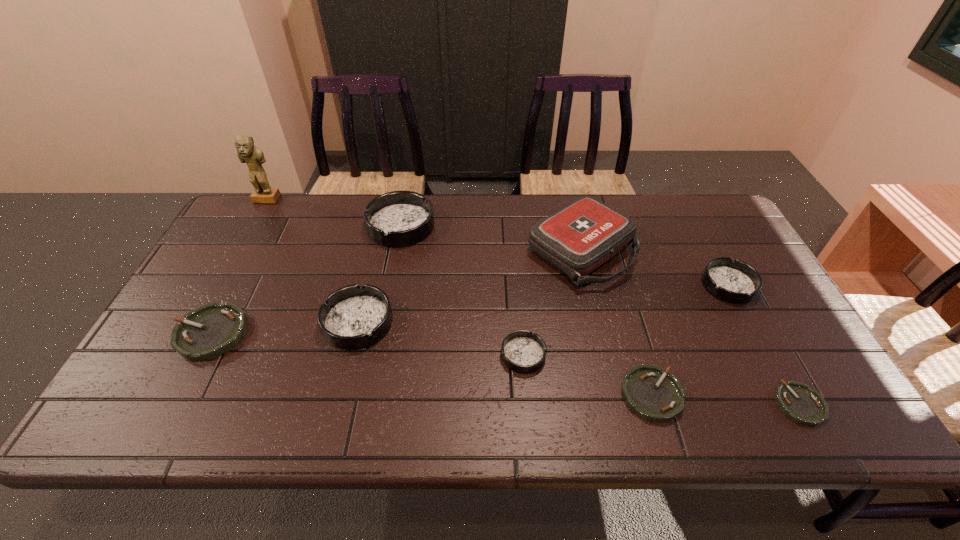
Locate an element on the screen. This screenshot has width=960, height=540. vacant space located 0.290m on the right of the third smallest dark ashtray is located at coordinates (505, 322).

Where is `vacant space situated 0.340m on the left of the fifth shortest object`? Image resolution: width=960 pixels, height=540 pixels. vacant space situated 0.340m on the left of the fifth shortest object is located at coordinates (581, 285).

This screenshot has width=960, height=540. What are the coordinates of `blank area located 0.300m on the back of the leftmost green ashtray` in the screenshot? It's located at (263, 234).

The height and width of the screenshot is (540, 960). In order to click on free spot located 0.220m on the right of the third dark ashtray from left to right in this screenshot , I will do `click(636, 355)`.

Locate an element on the screen. vacant area situated 0.400m on the left of the second shortest object is located at coordinates (444, 395).

Identify the location of vacant space located 0.270m on the left of the smallest green ashtray. (655, 404).

Locate an element on the screen. figurine present at the far edge is located at coordinates (253, 156).

Find the location of a particular element. the first-aid kit positioned at the far edge is located at coordinates (577, 239).

Find the location of `ashtray located in the far edge section of the desktop`. ashtray located in the far edge section of the desktop is located at coordinates (399, 218).

Identify the location of figurine at the left edge. (253, 156).